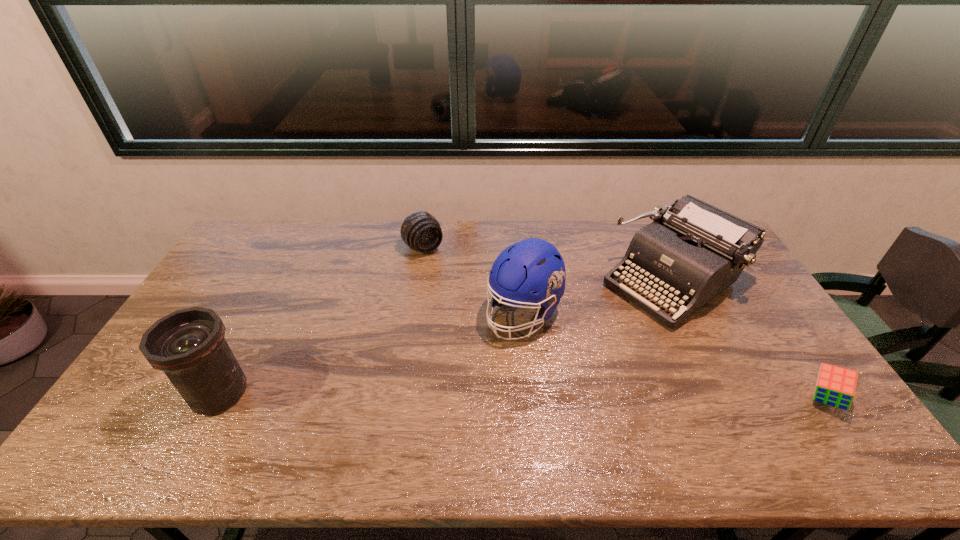
This screenshot has height=540, width=960. I want to click on vacant space on the desktop that is between the leftmost object and the shortest object and is positioned on the front-facing side of the football helmet, so tap(448, 395).

The width and height of the screenshot is (960, 540). I want to click on vacant spot on the desktop that is between the leftmost object and the shortest object and is positioned on the front-facing side of the typewriter, so click(x=501, y=395).

Locate an element on the screen. free space on the desktop that is between the leftmost object and the cube and is positioned at the front element of the shorter telephoto lens is located at coordinates (555, 396).